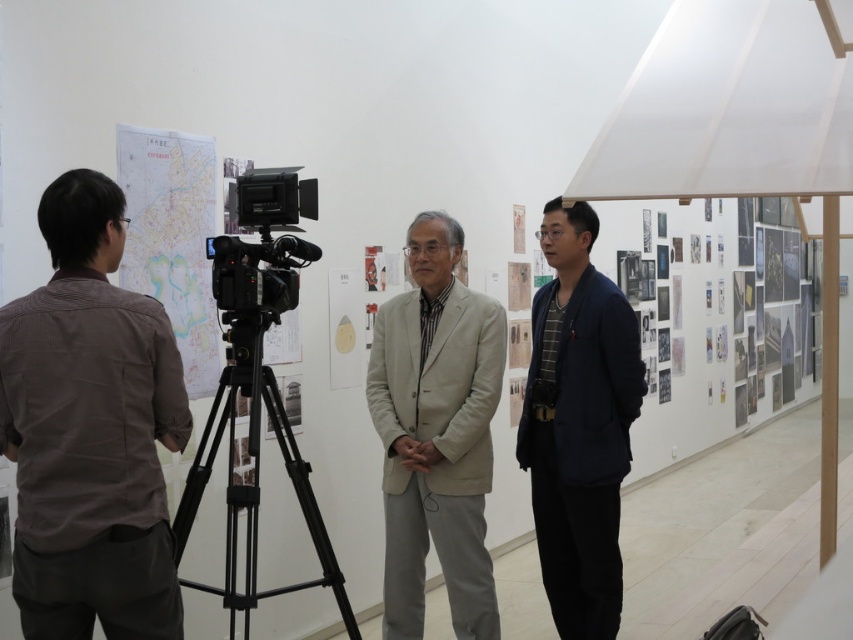
Question: Which of the following is the farthest from the observer?

Choices:
 (A) matte paper map at left
 (B) brown textured shirt at left

Answer: (A)

Question: Is the position of dark blue suit at center more distant than that of black metal tripod at center?

Choices:
 (A) yes
 (B) no

Answer: (A)

Question: Is brown textured shirt at left wider than beige fabric suit at center?

Choices:
 (A) no
 (B) yes

Answer: (A)

Question: Estimate the real-world distances between objects in this image. Which object is closer to the matte paper map at left?

Choices:
 (A) black metal tripod at center
 (B) dark blue suit at center
 (C) beige fabric suit at center
 (D) brown textured shirt at left

Answer: (A)

Question: Which of the following is the closest to the observer?

Choices:
 (A) dark blue suit at center
 (B) black metal tripod at center

Answer: (B)

Question: Can you confirm if beige fabric suit at center is positioned below matte paper map at left?

Choices:
 (A) yes
 (B) no

Answer: (A)